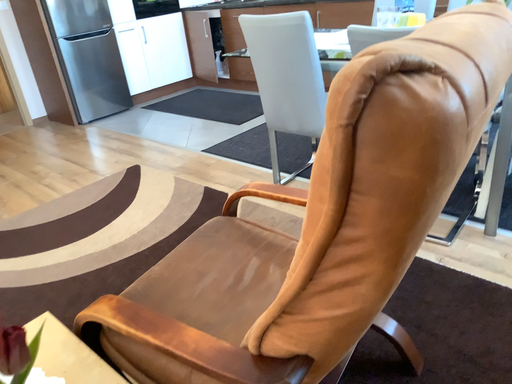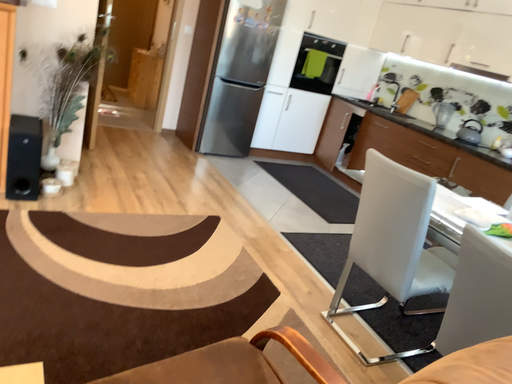
Question: How did the camera likely rotate when shooting the video?

Choices:
 (A) rotated downward
 (B) rotated upward

Answer: (B)